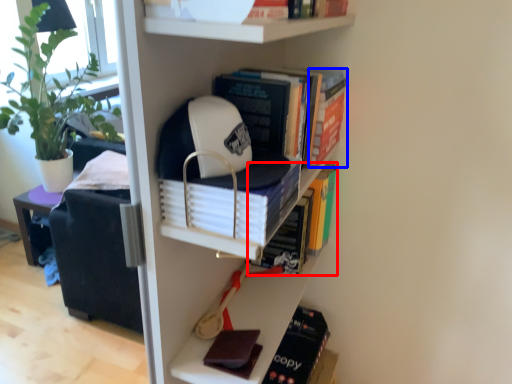
Question: Which object is closer to the camera taking this photo, book (highlighted by a red box) or book (highlighted by a blue box)?

Choices:
 (A) book
 (B) book

Answer: (B)